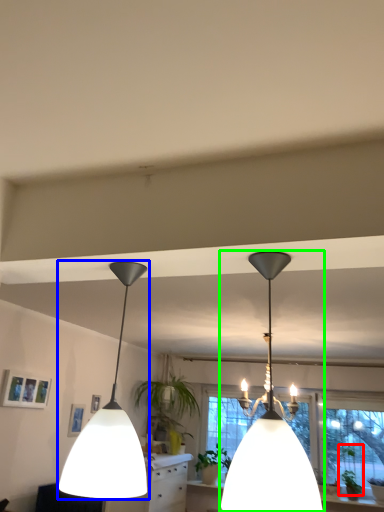
Question: Which is nearer to the plant (highlighted by a red box)? lamp (highlighted by a blue box) or lamp (highlighted by a green box).

Choices:
 (A) lamp
 (B) lamp

Answer: (B)